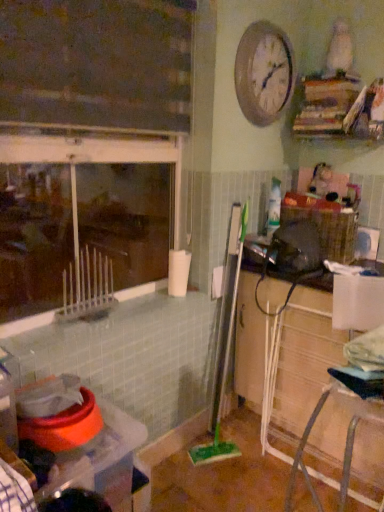
The image size is (384, 512). I want to click on wooden cabinet at lower right, so click(x=284, y=359).

In order to face metallic silver clock at upper center, should I rotate leftwards or rightwards?

Rotate right and turn 10.469 degrees.

Describe the element at coordinates (101, 459) in the screenshot. I see `plastic container at lower left` at that location.

Image resolution: width=384 pixels, height=512 pixels. In order to click on wooden cabinet at lower right in this screenshot , I will do `click(284, 359)`.

The image size is (384, 512). Identify the location of brush on the left of metallic silver clock at upper center. (224, 374).

Is metallic silver clock at upper center next to green plastic brush at center?

metallic silver clock at upper center is not next to green plastic brush at center, and they're not touching.

Is point (277, 53) positioned after point (242, 217)?

No, (277, 53) is in front of (242, 217).

Between metallic silver clock at upper center and green plastic brush at center, which one has less height?

With less height is metallic silver clock at upper center.

Is wooden cabinet at lower right at the back of plastic container at lower left?

plastic container at lower left is not turned away from wooden cabinet at lower right.

Which is behind, plastic container at lower left or wooden cabinet at lower right?

wooden cabinet at lower right is behind.

Can you tell me how much plastic container at lower left and wooden cabinet at lower right differ in facing direction?

They differ by 89.2 degrees in their facing directions.

Looking at their sizes, would you say wooden cabinet at lower right is wider or thinner than metallic silver clock at upper center?

Clearly, wooden cabinet at lower right has more width compared to metallic silver clock at upper center.

Do you think wooden cabinet at lower right is within metallic silver clock at upper center, or outside of it?

wooden cabinet at lower right is outside metallic silver clock at upper center.

Between point (280, 321) and point (254, 54), which one is positioned in front?

Point (254, 54)

Looking at the image, does green plastic brush at center seem bigger or smaller compared to woven brown basket at right?

Considering their sizes, green plastic brush at center takes up less space than woven brown basket at right.

Is green plastic brush at center taller or shorter than woven brown basket at right?

Clearly, green plastic brush at center is taller compared to woven brown basket at right.

Is there a large distance between green plastic brush at center and woven brown basket at right?

green plastic brush at center is positioned a significant distance from woven brown basket at right.

From the picture: Can we say green plastic brush at center lies outside woven brown basket at right?

Yes.

Identify the location of crate located behind the green plastic brush at center. The image size is (384, 512). (329, 229).

Is woven brown basket at right aimed at green plastic brush at center?

No, woven brown basket at right is not oriented towards green plastic brush at center.

Is woven brown basket at right bigger or smaller than green plastic brush at center?

Clearly, woven brown basket at right is larger in size than green plastic brush at center.

From a real-world perspective, is woven brown basket at right positioned above or below green plastic brush at center?

In terms of real-world spatial position, woven brown basket at right is above green plastic brush at center.

Between wooden cabinet at lower right and green plastic brush at center, which one appears on the left side from the viewer's perspective?

From the viewer's perspective, green plastic brush at center appears more on the left side.

Which is behind, point (343, 439) or point (225, 447)?

The point (225, 447) is more distant.

Does wooden cabinet at lower right touch green plastic brush at center?

wooden cabinet at lower right is not next to green plastic brush at center, and they're not touching.

Based on their sizes in the image, would you say wooden cabinet at lower right is bigger or smaller than green plastic brush at center?

In the image, wooden cabinet at lower right appears to be larger than green plastic brush at center.

Considering the positions of objects green plastic brush at center and wooden cabinet at lower right in the image provided, who is more to the left, green plastic brush at center or wooden cabinet at lower right?

Positioned to the left is green plastic brush at center.

Does green plastic brush at center lie in front of wooden cabinet at lower right?

No, it is behind wooden cabinet at lower right.

From a real-world perspective, which is physically below, green plastic brush at center or wooden cabinet at lower right?

wooden cabinet at lower right is physically lower.

Find the location of a particular element. This screenshot has width=384, height=512. brush on the left of wooden cabinet at lower right is located at coordinates (224, 374).

Locate an element on the screen. clock that appears above the green plastic brush at center (from the image's perspective) is located at coordinates (264, 73).

This screenshot has width=384, height=512. In order to click on table located in front of the wooden cabinet at lower right in this screenshot , I will do `click(101, 459)`.

When comparing their distances from metallic silver clock at upper center, does green plastic brush at center or plastic container at lower left seem closer?

plastic container at lower left.

Considering their positions, is wooden cabinet at lower right positioned closer to woven brown basket at right than green plastic brush at center?

wooden cabinet at lower right lies closer to woven brown basket at right than the other object.

Which object lies nearer to the anchor point green plastic brush at center, metallic silver clock at upper center or woven brown basket at right?

woven brown basket at right lies closer to green plastic brush at center than the other object.

Based on their spatial positions, is metallic silver clock at upper center or plastic container at lower left closer to green plastic brush at center?

plastic container at lower left is positioned closer to the anchor green plastic brush at center.

Considering their positions, is wooden cabinet at lower right positioned further to plastic container at lower left than woven brown basket at right?

woven brown basket at right is further to plastic container at lower left.

Estimate the real-world distances between objects in this image. Which object is further from metallic silver clock at upper center, woven brown basket at right or plastic container at lower left?

plastic container at lower left is further to metallic silver clock at upper center.

From the image, which object appears to be farther from woven brown basket at right, metallic silver clock at upper center or plastic container at lower left?

plastic container at lower left.

From the image, which object appears to be farther from plastic container at lower left, woven brown basket at right or metallic silver clock at upper center?

Based on the image, metallic silver clock at upper center appears to be further to plastic container at lower left.

Find the location of a particular element. This screenshot has width=384, height=512. brush between woven brown basket at right and wooden cabinet at lower right in the up-down direction is located at coordinates (224, 374).

At what (x,y) coordinates should I click in order to perform the action: click on crate that lies between metallic silver clock at upper center and green plastic brush at center from top to bottom. Please return your answer as a coordinate pair (x, y). Image resolution: width=384 pixels, height=512 pixels. Looking at the image, I should click on (329, 229).

Find the location of a particular element. crate between metallic silver clock at upper center and wooden cabinet at lower right in the up-down direction is located at coordinates (329, 229).

Identify the location of brush between plastic container at lower left and woven brown basket at right in the horizontal direction. This screenshot has height=512, width=384. (224, 374).